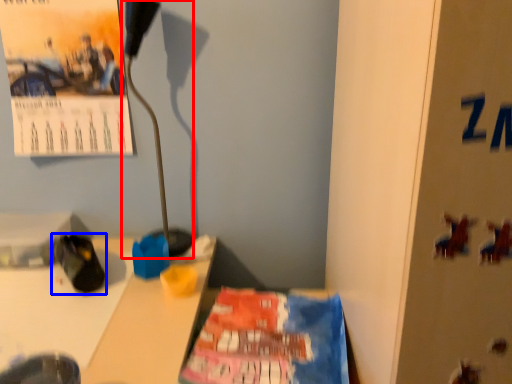
Question: Among these objects, which one is farthest to the camera, lamp (highlighted by a red box) or footwear (highlighted by a blue box)?

Choices:
 (A) lamp
 (B) footwear

Answer: (A)